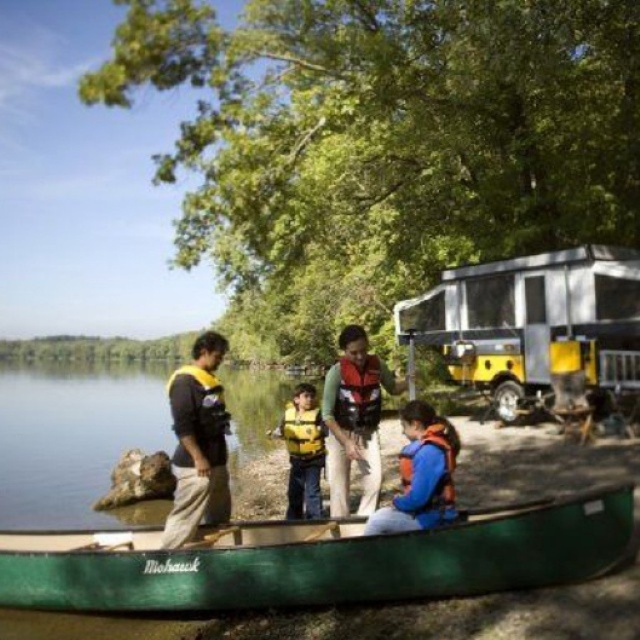
You are a lifeguard on duty at the lakeside. You notice the clear blue water at center and the yellow life vest at center. Which object takes up more space in the image?

The clear blue water at center is larger in size than the yellow life vest at center, so the clear blue water at center takes up more space in the image.

You are a safety inspector checking the proper placement of life vests in the canoe. According to the image, is the matte orange life vest at center located above or below the green matte canoe at center?

The green matte canoe at center is positioned under the matte orange life vest at center, so the matte orange life vest at center is above the green matte canoe at center.